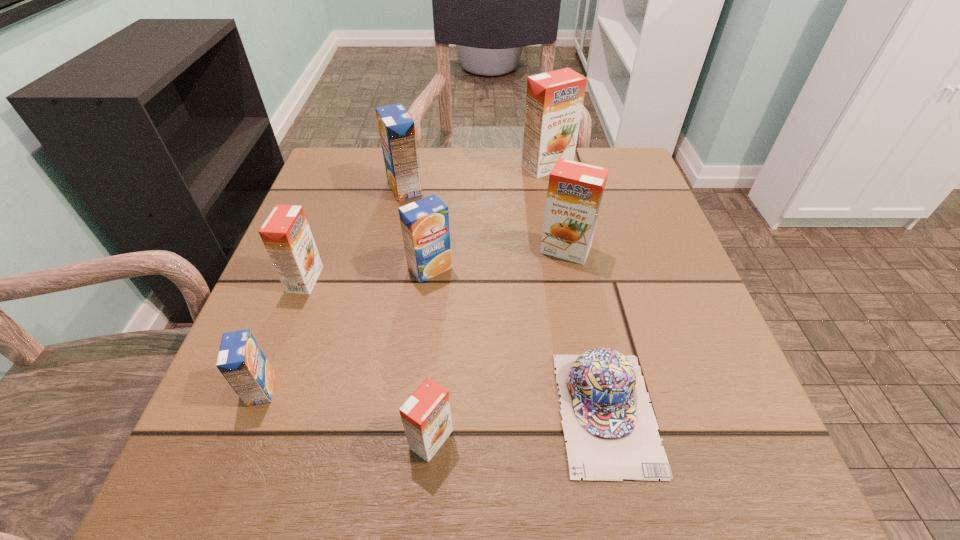
Locate which object is the fourth closest to the farthest orange orange juice. Please provide its 2D coordinates. Your answer should be formatted as a tuple, i.e. [(x, y)], where the tuple contains the x and y coordinates of a point satisfying the conditions above.

[(286, 234)]

At what (x,y) coordinates should I click in order to perform the action: click on orange_juice that is the second nearest to the second farthest orange orange juice. Please return your answer as a coordinate pair (x, y). Looking at the image, I should click on click(554, 100).

Locate which orange_juice ranks in proximity to the second smallest blue orange_juice. Please provide its 2D coordinates. Your answer should be formatted as a tuple, i.e. [(x, y)], where the tuple contains the x and y coordinates of a point satisfying the conditions above.

[(286, 234)]

Identify the location of orange orange juice that stands as the second closest to the second farthest orange orange juice. (426, 416).

Select which orange orange juice is the closest to the second farthest orange orange juice. Please provide its 2D coordinates. Your answer should be formatted as a tuple, i.e. [(x, y)], where the tuple contains the x and y coordinates of a point satisfying the conditions above.

[(554, 100)]

This screenshot has width=960, height=540. What are the coordinates of `blue orange_juice that is the closest to the nearest orange_juice` in the screenshot? It's located at (241, 361).

Choose which blue orange_juice is the third nearest neighbor to the second farthest orange orange juice. Please provide its 2D coordinates. Your answer should be formatted as a tuple, i.e. [(x, y)], where the tuple contains the x and y coordinates of a point satisfying the conditions above.

[(241, 361)]

Where is `vacant space that satisfies the following two spatial constraints: 1. on the back side of the farthest blue orange_juice; 2. on the right side of the leftmost blue orange_juice`? The height and width of the screenshot is (540, 960). vacant space that satisfies the following two spatial constraints: 1. on the back side of the farthest blue orange_juice; 2. on the right side of the leftmost blue orange_juice is located at coordinates (338, 188).

The width and height of the screenshot is (960, 540). I want to click on free region that satisfies the following two spatial constraints: 1. on the back side of the smallest blue orange_juice; 2. on the right side of the second biggest blue orange_juice, so click(x=307, y=268).

The height and width of the screenshot is (540, 960). Identify the location of free space that satisfies the following two spatial constraints: 1. on the front side of the biggest blue orange_juice; 2. on the right side of the nearest orange orange juice. (353, 440).